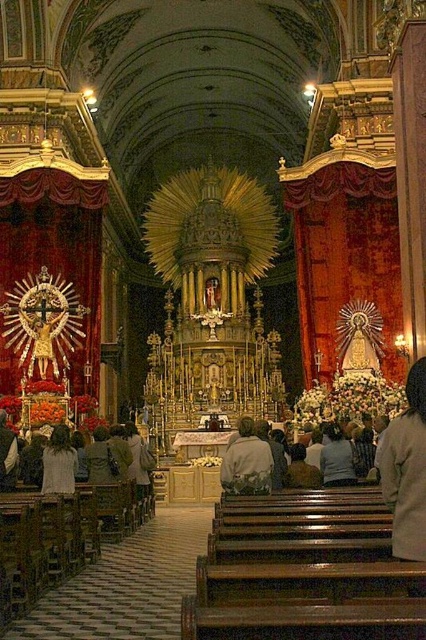
In the church scene, you see a light beige coat at lower right and a light beige jacket at center. Which one is positioned more to the right side of the scene?

The light beige coat at lower right is positioned more to the right side of the scene compared to the light beige jacket at center.

You are standing in the church and want to take a photo of the light beige jacket at center without the light beige coat at lower right blocking the view. Is this possible?

The light beige coat at lower right is in front of the light beige jacket at center, so it will block the view. To take a photo of the light beige jacket at center without obstruction, you would need to move around the light beige coat at lower right or adjust your angle to ensure it is not in the foreground.